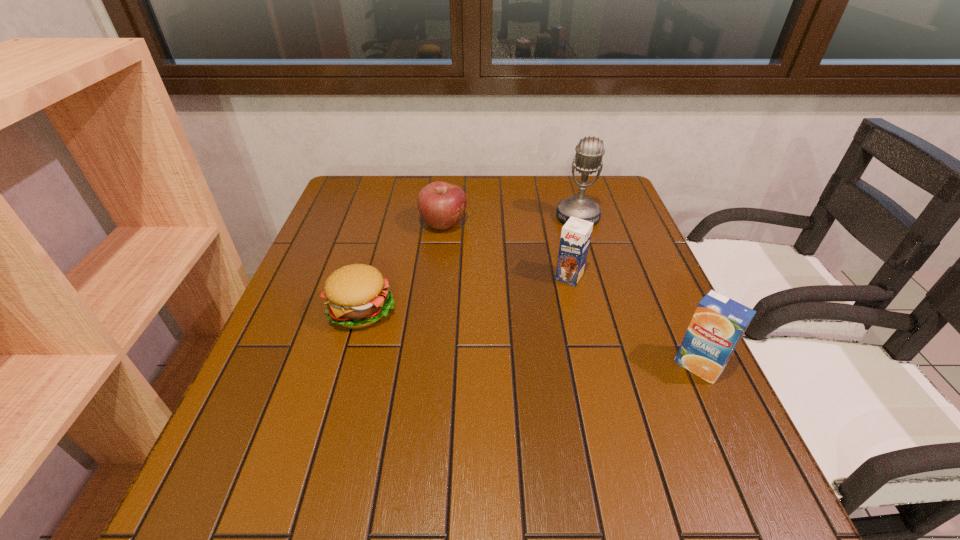
In order to click on hamburger in this screenshot , I will do `click(357, 296)`.

This screenshot has width=960, height=540. I want to click on the rightmost object, so click(x=718, y=324).

The width and height of the screenshot is (960, 540). In order to click on the nearest object in this screenshot , I will do `click(718, 324)`.

This screenshot has height=540, width=960. In order to click on microphone in this screenshot , I will do `click(589, 152)`.

Where is `the second object from left to right`? The height and width of the screenshot is (540, 960). the second object from left to right is located at coordinates (442, 205).

Where is `chocolate milk`? The width and height of the screenshot is (960, 540). chocolate milk is located at coordinates (576, 233).

You are a GUI agent. You are given a task and a screenshot of the screen. Output one action in this format:
    pyautogui.click(x=<x>, y=<y>)
    Task: Click on the vacant area situated 0.190m on the right of the hamburger
    Image resolution: width=960 pixels, height=540 pixels.
    Given the screenshot: What is the action you would take?
    pyautogui.click(x=479, y=309)

The image size is (960, 540). What are the coordinates of `vacant space located on the left of the orange_juice` in the screenshot? It's located at (587, 366).

The height and width of the screenshot is (540, 960). Identify the location of vacant area situated on the front-facing side of the tallest object. (572, 261).

At what (x,y) coordinates should I click in order to perform the action: click on vacant point located on the front-facing side of the tallest object. Please return your answer as a coordinate pair (x, y). Image resolution: width=960 pixels, height=540 pixels. Looking at the image, I should click on (564, 322).